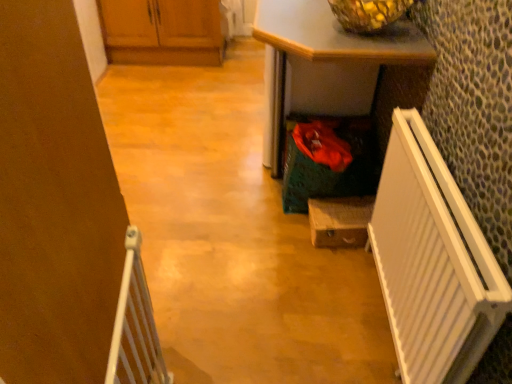
Question: Which direction should I rotate to look at wooden drawer at center, marked as the 2th cabinetry in a left-to-right arrangement, — up or down?

Choices:
 (A) up
 (B) down

Answer: (B)

Question: From the image's perspective, is wooden drawer at center, which appears as the 2th cabinetry when viewed from the top, over wooden cabinets at upper left, which appears as the 2th cabinetry when ordered from the bottom?

Choices:
 (A) yes
 (B) no

Answer: (B)

Question: Does wooden drawer at center, which is counted as the 1th cabinetry, starting from the right, have a lesser width compared to wooden cabinets at upper left, arranged as the 1th cabinetry when viewed from the left?

Choices:
 (A) no
 (B) yes

Answer: (B)

Question: Does wooden drawer at center, which is counted as the 1th cabinetry, starting from the right, have a greater width compared to wooden cabinets at upper left, arranged as the 1th cabinetry when viewed from the left?

Choices:
 (A) no
 (B) yes

Answer: (A)

Question: From the image's perspective, is wooden drawer at center, which is the second cabinetry in back-to-front order, under wooden cabinets at upper left, which appears as the 2th cabinetry when ordered from the bottom?

Choices:
 (A) yes
 (B) no

Answer: (A)

Question: Does wooden drawer at center, which appears as the 2th cabinetry when viewed from the top, lie behind wooden cabinets at upper left, marked as the 1th cabinetry in a top-to-bottom arrangement?

Choices:
 (A) no
 (B) yes

Answer: (A)

Question: Is wooden drawer at center, which appears as the 2th cabinetry when viewed from the top, in front of wooden cabinets at upper left, marked as the 1th cabinetry in a top-to-bottom arrangement?

Choices:
 (A) yes
 (B) no

Answer: (A)

Question: Does wooden drawer at center, which is counted as the 1th cabinetry, starting from the right, come in front of green textured desk at center?

Choices:
 (A) yes
 (B) no

Answer: (B)

Question: Is wooden drawer at center, which is the first cabinetry from bottom to top, surrounding green textured desk at center?

Choices:
 (A) yes
 (B) no

Answer: (B)

Question: Considering the relative sizes of wooden drawer at center, which is the first cabinetry from bottom to top, and green textured desk at center in the image provided, is wooden drawer at center, which is the first cabinetry from bottom to top, smaller than green textured desk at center?

Choices:
 (A) yes
 (B) no

Answer: (A)

Question: From the image's perspective, is wooden drawer at center, which is counted as the 1th cabinetry, starting from the right, located beneath green textured desk at center?

Choices:
 (A) no
 (B) yes

Answer: (B)

Question: Considering the relative sizes of wooden drawer at center, which is the first cabinetry from bottom to top, and green textured desk at center in the image provided, is wooden drawer at center, which is the first cabinetry from bottom to top, thinner than green textured desk at center?

Choices:
 (A) no
 (B) yes

Answer: (B)

Question: Is wooden drawer at center, acting as the 1th cabinetry starting from the front, placed right next to green textured desk at center?

Choices:
 (A) no
 (B) yes

Answer: (A)

Question: Can you confirm if wooden drawer at center, marked as the 2th cabinetry in a left-to-right arrangement, is positioned to the left of white plastic radiator at right, acting as the first radiator starting from the right?

Choices:
 (A) yes
 (B) no

Answer: (A)